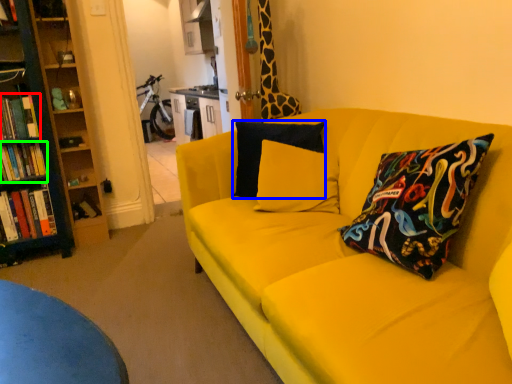
Question: Which is farther away from book (highlighted by a red box)? pillow (highlighted by a blue box) or book (highlighted by a green box)?

Choices:
 (A) pillow
 (B) book

Answer: (A)